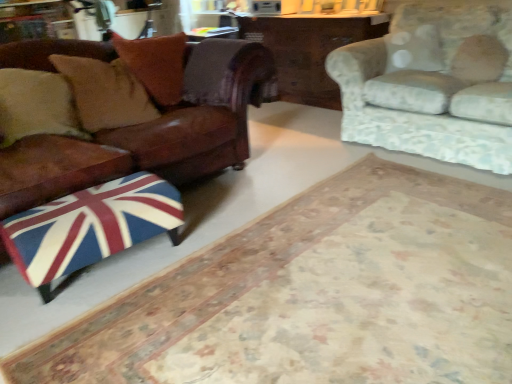
I want to click on free region on the left part of floral fabric couch at upper right, the first studio couch when ordered from right to left, so click(x=303, y=150).